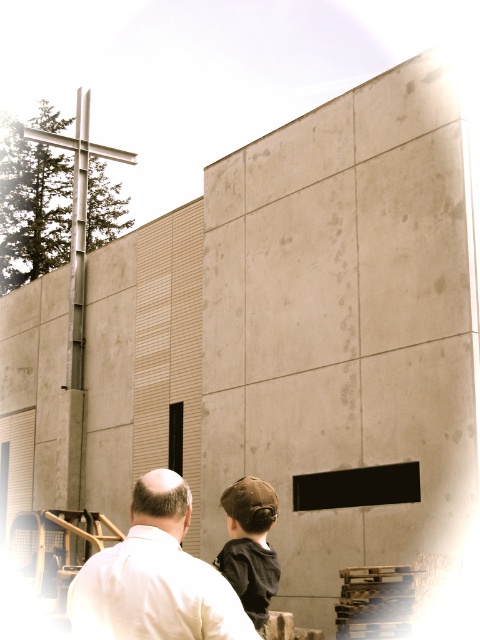
You are standing in front of the modern building and see the white matte shirt at lower left and the brown fabric cap at center. Which object is nearer to you?

The white matte shirt at lower left is closer to the viewer than the brown fabric cap at center.

You are a photographer trying to capture the building in the image. You notice the white matte shirt at lower left and the brown fabric cap at center in the foreground. Which object should you adjust your focus to ensure the larger one is in sharp detail?

The white matte shirt at lower left is larger in size than the brown fabric cap at center, so you should focus on the white matte shirt at lower left to ensure the larger object is in sharp detail.